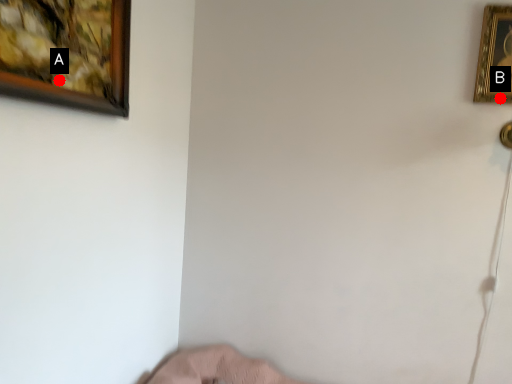
Question: Two points are circled on the image, labeled by A and B beside each circle. Which point is farther to the camera?

Choices:
 (A) A is further
 (B) B is further

Answer: (B)